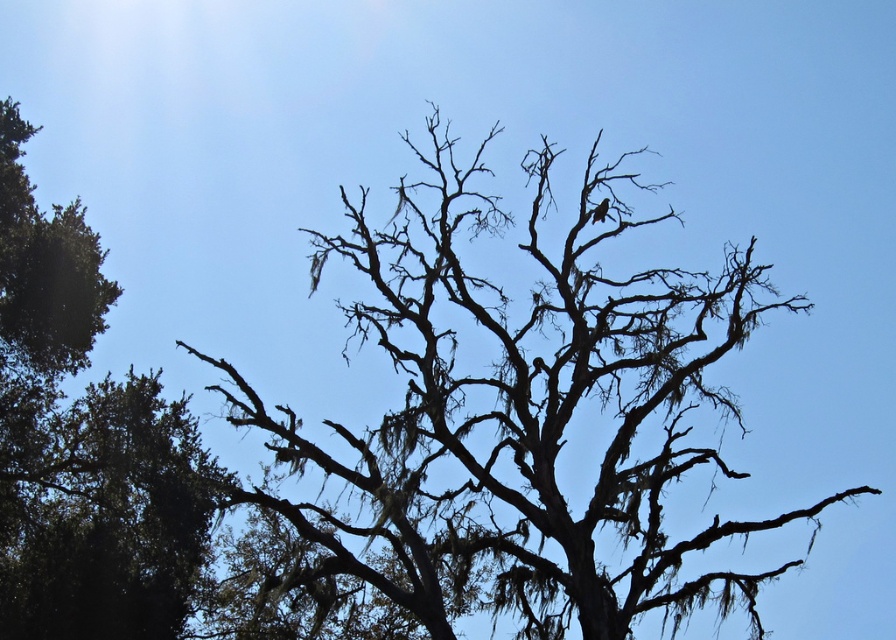
You are standing in a forest and see the silhouette bark tree at center and the green leafy tree at left. Which tree is closer to you?

The silhouette bark tree at center is closer to you because it is positioned in front of the green leafy tree at left.

You are standing in front of the tree and notice two points marked on the image. The first point is at coordinates point (722, 406) and the second is at point (195, 580). Which point is closer to you?

Point (722, 406) is in front of point (195, 580), so the first point is closer to you.